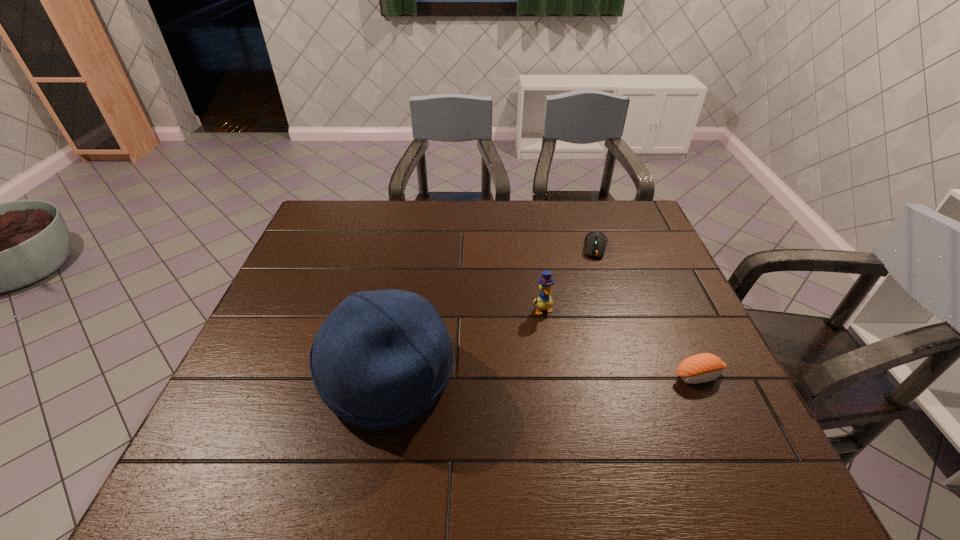
Identify the location of free space located 0.270m on the face of the second tallest object, where the monocle is placed. Image resolution: width=960 pixels, height=540 pixels. (593, 402).

Locate an element on the screen. vacant position located 0.280m on the face of the second tallest object, where the monocle is placed is located at coordinates (595, 406).

You are a GUI agent. You are given a task and a screenshot of the screen. Output one action in this format:
    pyautogui.click(x=<x>, y=<y>)
    Task: Click on the vacant space located on the face of the second tallest object, where the monocle is placed
    This screenshot has width=960, height=540.
    Given the screenshot: What is the action you would take?
    pyautogui.click(x=579, y=376)

Identify the location of vacant space located on the button of the third object from left to right. The height and width of the screenshot is (540, 960). (593, 274).

The image size is (960, 540). In order to click on vacant space located 0.230m on the button of the third object from left to right in this screenshot , I will do `click(588, 312)`.

This screenshot has width=960, height=540. I want to click on vacant region located on the button of the third object from left to right, so click(589, 296).

What are the coordinates of `object at the far edge` in the screenshot? It's located at (595, 242).

You are a GUI agent. You are given a task and a screenshot of the screen. Output one action in this format:
    pyautogui.click(x=<x>, y=<y>)
    Task: Click on the object at the near edge
    The width and height of the screenshot is (960, 540).
    Given the screenshot: What is the action you would take?
    pyautogui.click(x=382, y=358)

Find the location of a particular element. The height and width of the screenshot is (540, 960). sushi that is at the right edge is located at coordinates (704, 367).

At what (x,y) coordinates should I click in order to perform the action: click on computer equipment situated at the right edge. Please return your answer as a coordinate pair (x, y). The image size is (960, 540). Looking at the image, I should click on (595, 242).